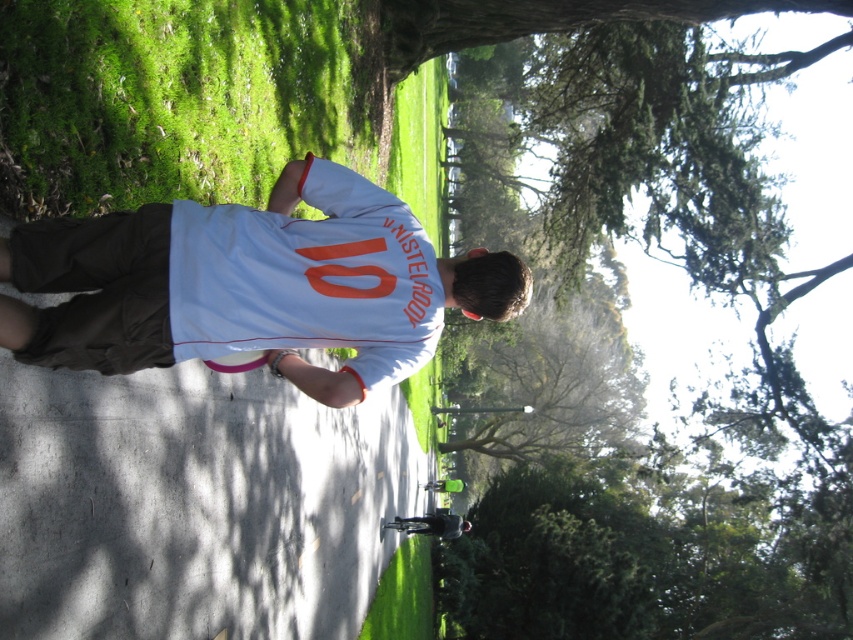
Question: Does white smooth concrete at center have a smaller size compared to white matte shirt at center?

Choices:
 (A) no
 (B) yes

Answer: (A)

Question: Is green leafy tree at upper center bigger than white matte shirt at center?

Choices:
 (A) yes
 (B) no

Answer: (A)

Question: Can you confirm if green leafy tree at upper center is smaller than white smooth concrete at center?

Choices:
 (A) yes
 (B) no

Answer: (B)

Question: Among these points, which one is nearest to the camera?

Choices:
 (A) (9, 307)
 (B) (305, 461)
 (C) (840, 435)

Answer: (A)

Question: Among these points, which one is nearest to the camera?

Choices:
 (A) (762, 301)
 (B) (251, 406)

Answer: (B)

Question: Which point is closer to the camera?

Choices:
 (A) white smooth concrete at center
 (B) green leafy tree at upper center

Answer: (A)